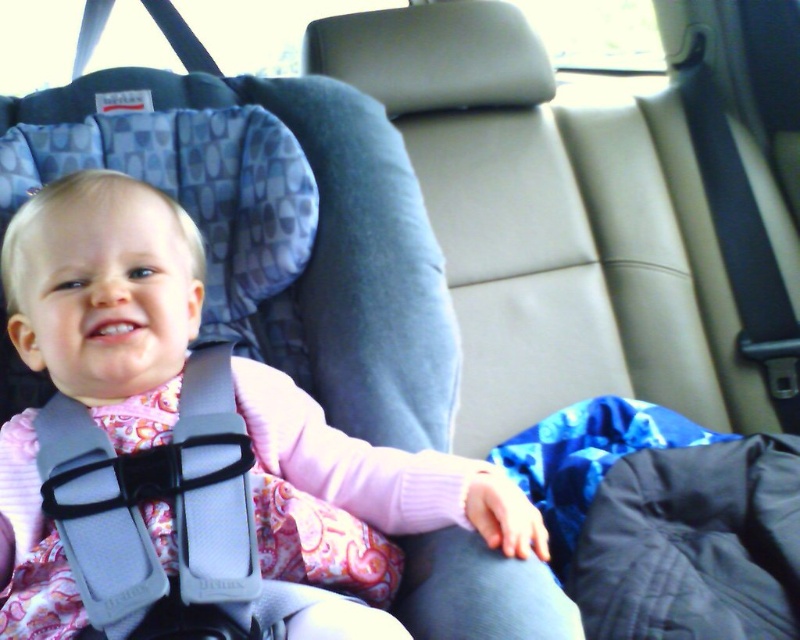
Is gray fabric strap at center behind gray fabric seatbelt at upper left?

No.

Looking at this image, who is shorter, gray fabric strap at center or gray fabric seatbelt at upper left?

gray fabric strap at center is shorter.

This screenshot has height=640, width=800. I want to click on gray fabric strap at center, so click(x=158, y=499).

At what (x,y) coordinates should I click in order to perform the action: click on gray fabric strap at center. Please return your answer as a coordinate pair (x, y). This screenshot has width=800, height=640. Looking at the image, I should click on (158, 499).